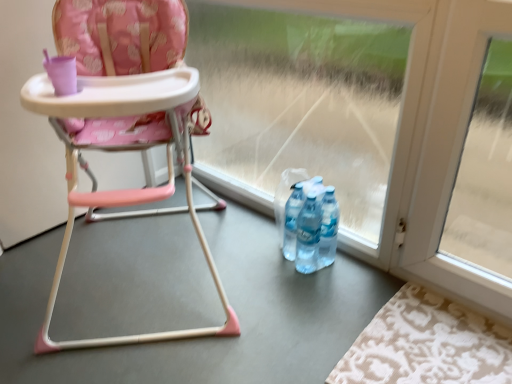
Question: Does beige damask rug at lower right lie in front of transparent glass door at center?

Choices:
 (A) no
 (B) yes

Answer: (B)

Question: From the image's perspective, is beige damask rug at lower right located beneath transparent glass door at center?

Choices:
 (A) no
 (B) yes

Answer: (B)

Question: Is the surface of beige damask rug at lower right in direct contact with transparent glass door at center?

Choices:
 (A) no
 (B) yes

Answer: (A)

Question: Is beige damask rug at lower right shorter than transparent glass door at center?

Choices:
 (A) no
 (B) yes

Answer: (B)

Question: Does beige damask rug at lower right appear on the left side of transparent glass door at center?

Choices:
 (A) no
 (B) yes

Answer: (A)

Question: Considering their positions, is transparent glass door at center located in front of or behind beige damask rug at lower right?

Choices:
 (A) behind
 (B) front

Answer: (A)

Question: Considering the positions of point (366, 162) and point (474, 331), is point (366, 162) closer or farther from the camera than point (474, 331)?

Choices:
 (A) closer
 (B) farther

Answer: (B)

Question: In terms of width, does transparent glass door at center look wider or thinner when compared to beige damask rug at lower right?

Choices:
 (A) thin
 (B) wide

Answer: (A)

Question: Is transparent glass door at center spatially inside beige damask rug at lower right, or outside of it?

Choices:
 (A) inside
 (B) outside

Answer: (B)

Question: From their relative heights in the image, would you say transparent glass door at center is taller or shorter than matte plastic highchair at center?

Choices:
 (A) short
 (B) tall

Answer: (A)

Question: From the image's perspective, is transparent glass door at center positioned above or below matte plastic highchair at center?

Choices:
 (A) below
 (B) above

Answer: (B)

Question: Is point (205, 69) closer or farther from the camera than point (120, 41)?

Choices:
 (A) closer
 (B) farther

Answer: (B)

Question: Looking at the image, does transparent glass door at center seem bigger or smaller compared to matte plastic highchair at center?

Choices:
 (A) big
 (B) small

Answer: (B)

Question: Considering the positions of point (377, 354) and point (162, 339), is point (377, 354) closer or farther from the camera than point (162, 339)?

Choices:
 (A) closer
 (B) farther

Answer: (A)

Question: Looking at their shapes, would you say beige damask rug at lower right is wider or thinner than matte plastic highchair at center?

Choices:
 (A) wide
 (B) thin

Answer: (B)